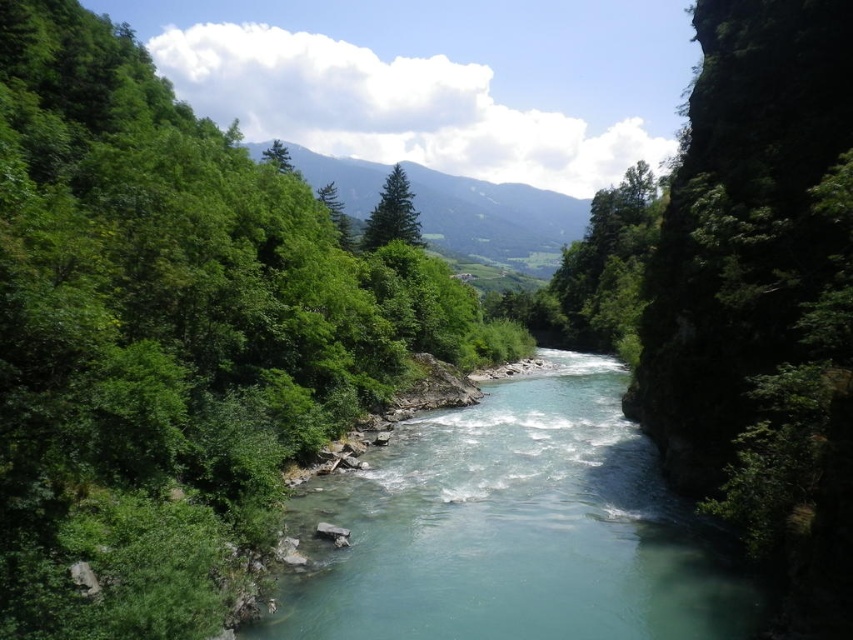
You are standing at the riverbank and want to place two markers at the coordinates point (296, 244) and point (349, 228). Which marker will be closer to your current position?

Point (296, 244) is closer to the viewer than point (349, 228), so the marker at point (296, 244) will be closer to your current position.

You are a hiker standing at the riverbank and see the green matte tree at center and the green matte tree at upper center. Which tree is positioned more to the right side of the river?

The green matte tree at center is positioned more to the right side of the river compared to the green matte tree at upper center.